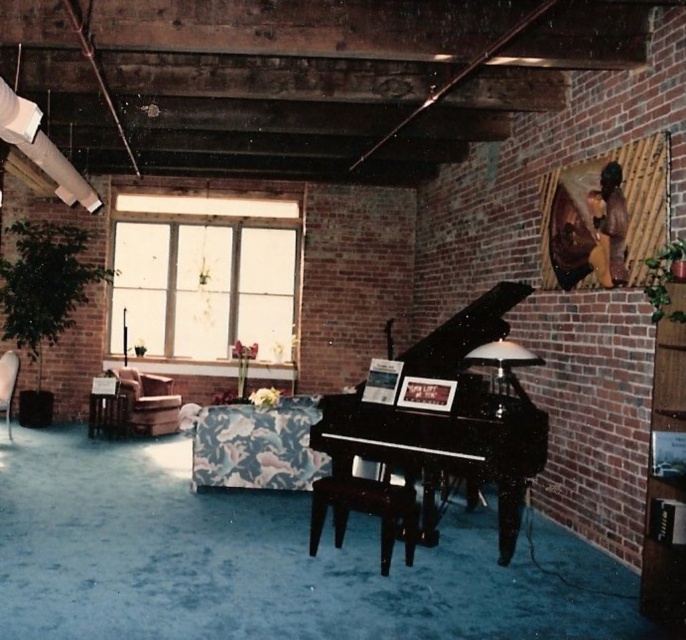
You are standing in the room and want to move from the shiny black stool at center to the black polished piano at center. Which direction should you move in?

You should move to the left to reach the black polished piano at center from the shiny black stool at center because the piano is positioned to the right of the stool.

You are a guest in this room and need to sit down. You see the shiny black stool at center and the brown leather armchair at left. Which one is shorter and thus might be more comfortable for someone of average height?

The shiny black stool at center is shorter than the brown leather armchair at left, so it might be more comfortable for someone of average height.

You are standing in the room and want to place a new piece of furniture at the point marked as point (379, 492). If the room is 20 feet deep from front to back, is this point within the first 10 feet of the room?

The distance of point (379, 492) from camera is 14.70 feet. Since the room is 20 feet deep, the first 10 feet would be from 0 to 10 feet. The point is at 14.70 feet, which is beyond the first 10 feet, so it is not within the first 10 feet of the room.